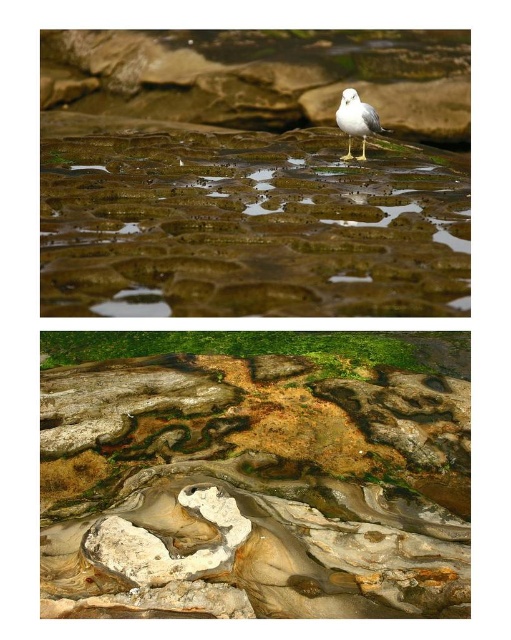
You are a geologist examining the image of a rocky coastal environment. You notice a translucent wet rock at center. Based on its position at coordinates point 0.348, 0.481, can you determine if it is located in the top or bottom section of the image?

The translucent wet rock at center is located at point (245, 221), which falls within the bottom section of the image.

You are a geologist examining the image of the rocky coastal environment. You need to locate the rough textured rock at center. What are its coordinates?

The rough textured rock at center is located at coordinates point (252, 488).

You are an ornithologist observing the coastal environment. You need to determine the spatial relationship between the rough textured rock at center and the white matte bird at center. Which object is wider?

The rough textured rock at center is wider than the white matte bird at center.